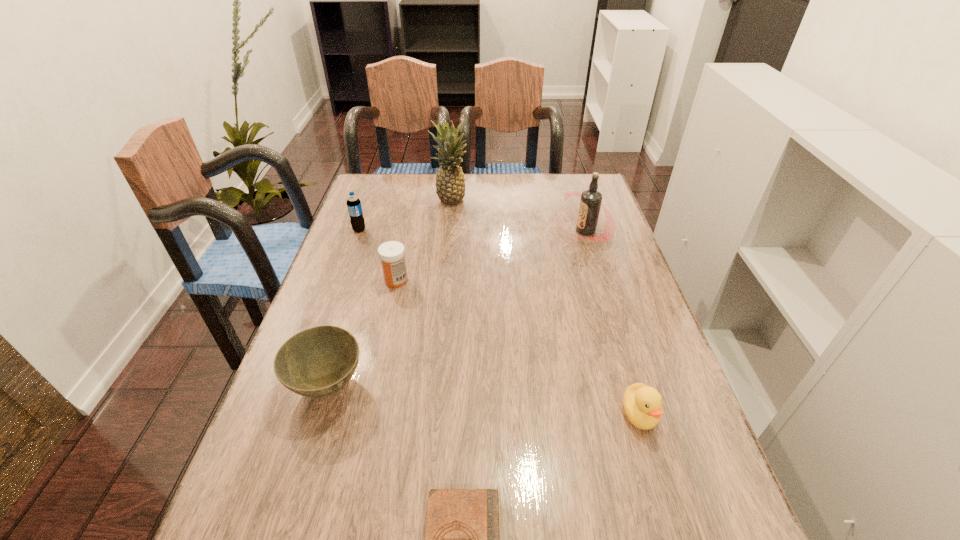
Locate an element on the screen. Image resolution: width=960 pixels, height=540 pixels. vacant space located 0.050m on the label of the sixth shortest object is located at coordinates (541, 231).

Find the location of a particular element. This screenshot has width=960, height=540. vacant space situated 0.360m on the right of the soda bottle is located at coordinates (479, 230).

Where is `free space located 0.400m on the front of the fourth nearest object`? free space located 0.400m on the front of the fourth nearest object is located at coordinates (366, 422).

The image size is (960, 540). Identify the location of free space located 0.170m on the right of the bowl. (444, 386).

Identify the location of vacant space located on the face of the duckling. This screenshot has width=960, height=540. (663, 493).

In order to click on object located in the far edge section of the desktop in this screenshot , I will do `click(450, 183)`.

In order to click on soda bottle at the left edge in this screenshot , I will do `click(354, 206)`.

You are a GUI agent. You are given a task and a screenshot of the screen. Output one action in this format:
    pyautogui.click(x=<x>, y=<y>)
    Task: Click on the bowl present at the left edge
    This screenshot has width=960, height=540.
    Given the screenshot: What is the action you would take?
    pyautogui.click(x=317, y=362)

I want to click on root beer located in the right edge section of the desktop, so click(x=591, y=200).

At what (x,y) coordinates should I click in order to perform the action: click on duckling positioned at the right edge. Please return your answer as a coordinate pair (x, y). Looking at the image, I should click on [x=642, y=404].